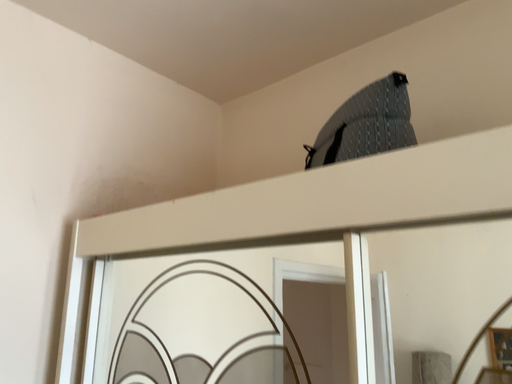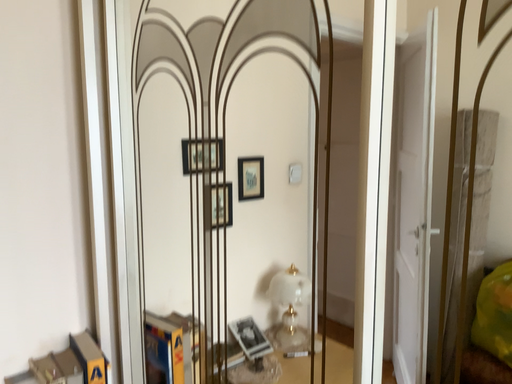
Question: How did the camera likely rotate when shooting the video?

Choices:
 (A) rotated downward
 (B) rotated upward

Answer: (A)